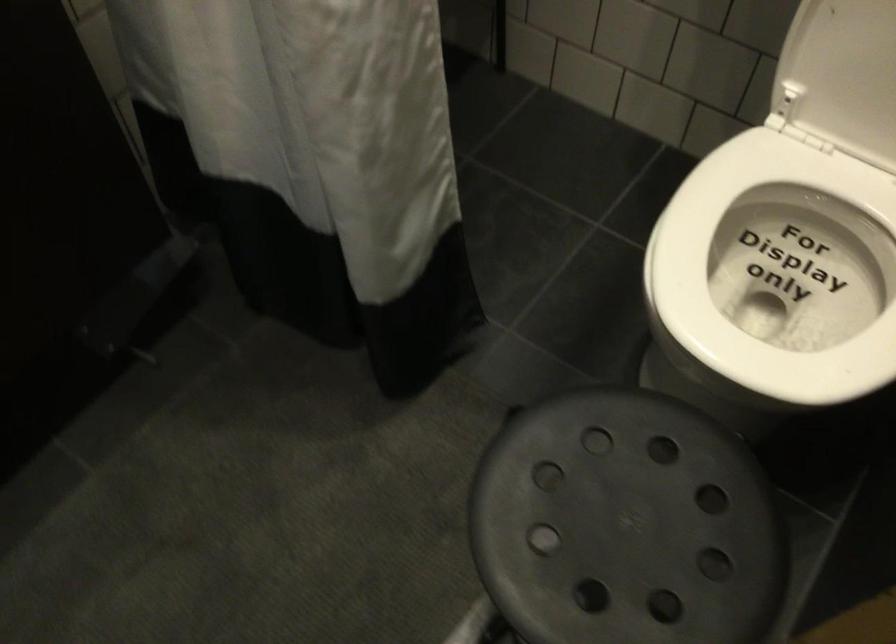
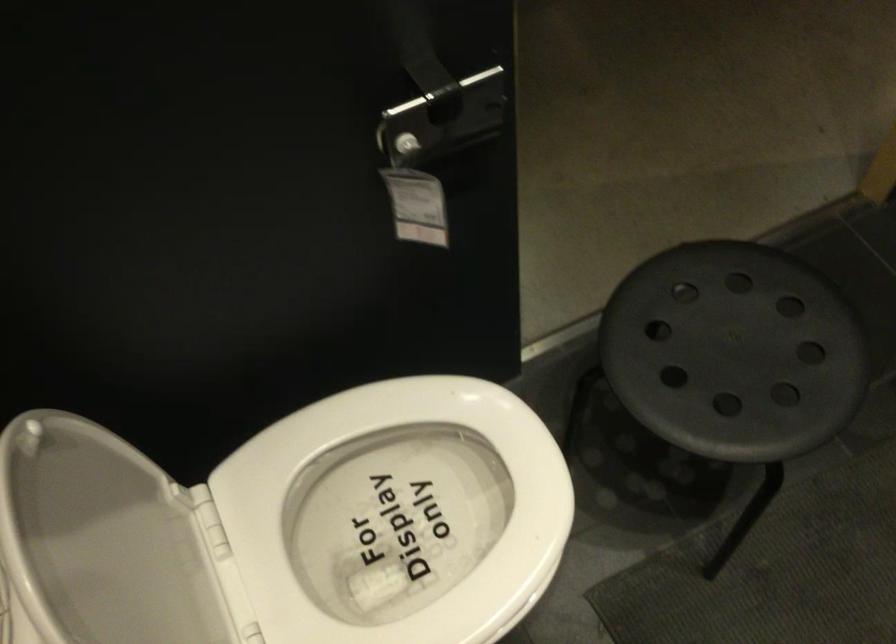
The point at (575,556) is marked in the first image. Where is the corresponding point in the second image?

(734, 351)